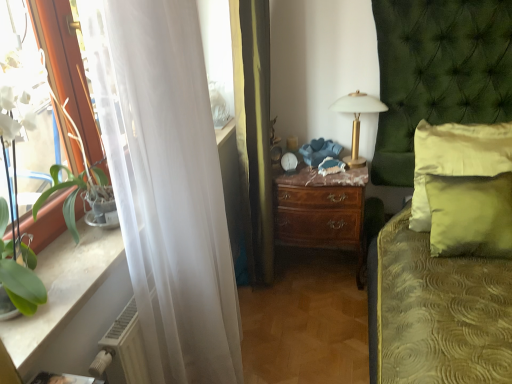
Locate an element on the screen. vacant space underneath brown wood nightstand at center (from a real-world perspective) is located at coordinates (321, 276).